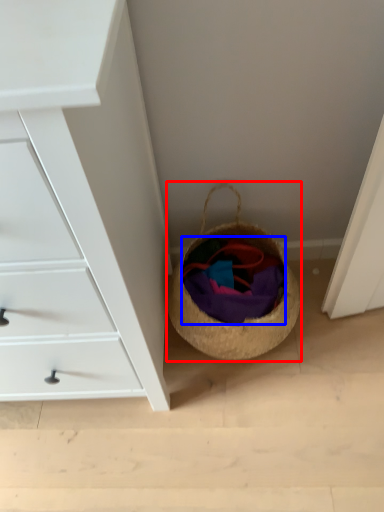
Question: Which point is further to the camera, basket (highlighted by a red box) or clothing (highlighted by a blue box)?

Choices:
 (A) basket
 (B) clothing

Answer: (B)